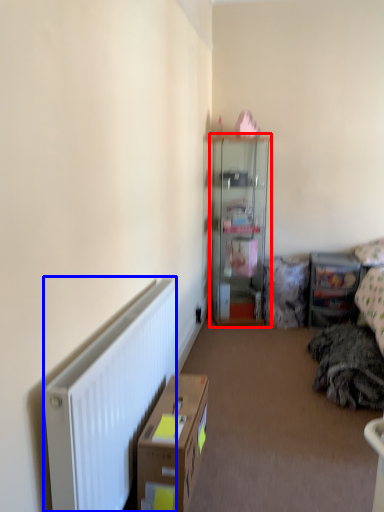
Question: Among these objects, which one is farthest to the camera, cabinetry (highlighted by a red box) or radiator (highlighted by a blue box)?

Choices:
 (A) cabinetry
 (B) radiator

Answer: (A)